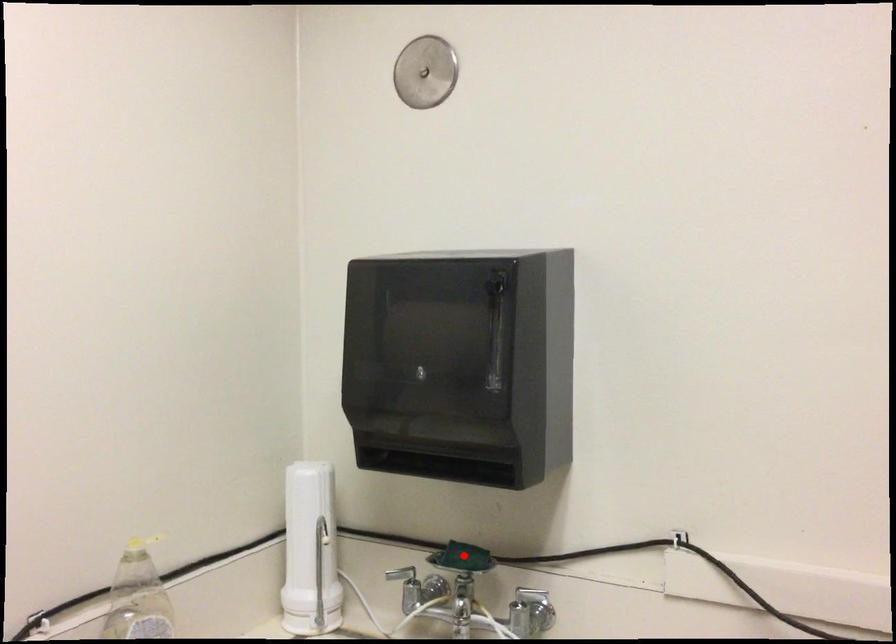
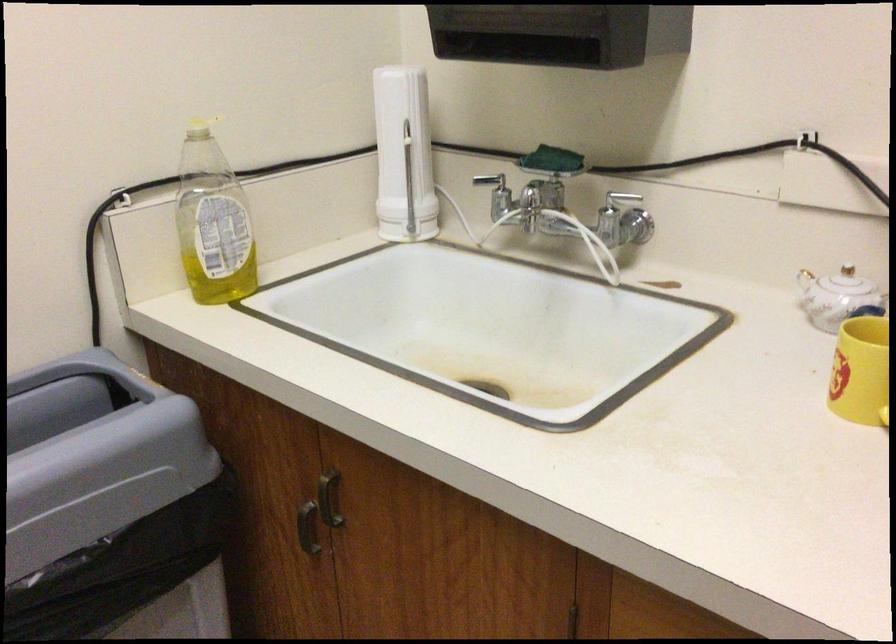
Find the pixel in the second image that matches the highlighted location in the first image.

(552, 160)